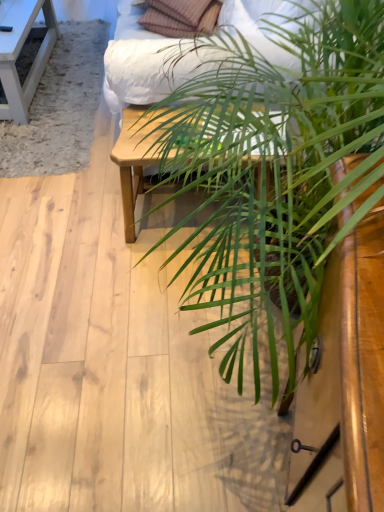
Question: Does plaid fabric pillow at upper center have a greater width compared to white wood table at upper left, which appears as the second table when ordered from the bottom?

Choices:
 (A) yes
 (B) no

Answer: (B)

Question: Is plaid fabric pillow at upper center facing away from white wood table at upper left, the 1th table positioned from the back?

Choices:
 (A) yes
 (B) no

Answer: (B)

Question: Is plaid fabric pillow at upper center behind white wood table at upper left, the second table in the right-to-left sequence?

Choices:
 (A) yes
 (B) no

Answer: (B)

Question: Can you confirm if plaid fabric pillow at upper center is positioned to the right of white wood table at upper left, which appears as the first table when viewed from the left?

Choices:
 (A) no
 (B) yes

Answer: (B)

Question: Does plaid fabric pillow at upper center have a greater height compared to white wood table at upper left, which appears as the first table when viewed from the left?

Choices:
 (A) yes
 (B) no

Answer: (B)

Question: From a real-world perspective, is green leafy plant at center positioned above or below light wood table at center, acting as the second table starting from the back?

Choices:
 (A) below
 (B) above

Answer: (B)

Question: Is green leafy plant at center wider or thinner than light wood table at center, the first table when ordered from right to left?

Choices:
 (A) thin
 (B) wide

Answer: (B)

Question: Relative to light wood table at center, the first table when ordered from right to left, is green leafy plant at center in front or behind?

Choices:
 (A) behind
 (B) front

Answer: (B)

Question: In terms of height, does green leafy plant at center look taller or shorter compared to light wood table at center, the first table when ordered from bottom to top?

Choices:
 (A) short
 (B) tall

Answer: (B)

Question: In terms of size, does green leafy plant at center appear bigger or smaller than plaid fabric pillow at upper center?

Choices:
 (A) small
 (B) big

Answer: (B)

Question: In the image, is green leafy plant at center on the left side or the right side of plaid fabric pillow at upper center?

Choices:
 (A) left
 (B) right

Answer: (B)

Question: Looking at their shapes, would you say green leafy plant at center is wider or thinner than plaid fabric pillow at upper center?

Choices:
 (A) wide
 (B) thin

Answer: (A)

Question: From the image's perspective, is green leafy plant at center above or below plaid fabric pillow at upper center?

Choices:
 (A) above
 (B) below

Answer: (B)

Question: From the image's perspective, is matte white bed frame at upper center above or below white wood table at upper left, the 1th table in the top-to-bottom sequence?

Choices:
 (A) above
 (B) below

Answer: (A)

Question: From a real-world perspective, is matte white bed frame at upper center above or below white wood table at upper left, which appears as the first table when viewed from the left?

Choices:
 (A) above
 (B) below

Answer: (A)